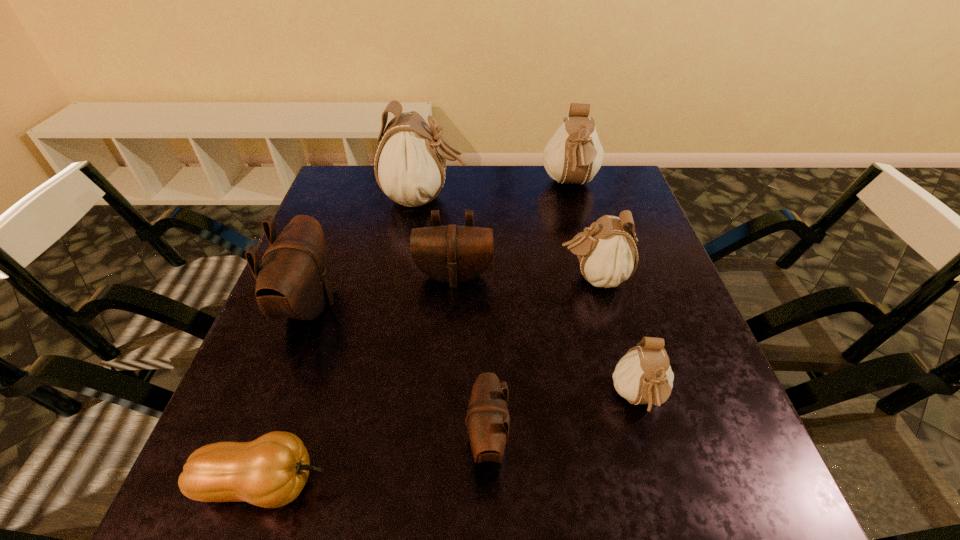
Locate an element on the screen. The width and height of the screenshot is (960, 540). vacant space located on the front-facing side of the biggest white pouch is located at coordinates (565, 199).

Where is `vacant space situated 0.270m on the front-facing side of the third smallest white pouch`? This screenshot has width=960, height=540. vacant space situated 0.270m on the front-facing side of the third smallest white pouch is located at coordinates (593, 271).

This screenshot has height=540, width=960. Find the location of `vacant area situated 0.150m with the flap open on the biggest brown pouch`. vacant area situated 0.150m with the flap open on the biggest brown pouch is located at coordinates (404, 304).

I want to click on free space located on the front-facing side of the third farthest white pouch, so click(408, 278).

Where is `vacant space located on the front-facing side of the third farthest white pouch`? The image size is (960, 540). vacant space located on the front-facing side of the third farthest white pouch is located at coordinates (421, 278).

Locate an element on the screen. free point located 0.170m on the front-facing side of the third farthest white pouch is located at coordinates (486, 278).

Where is `free point located 0.210m with the flap open on the second smallest brown pouch`? free point located 0.210m with the flap open on the second smallest brown pouch is located at coordinates (448, 368).

The height and width of the screenshot is (540, 960). Identify the location of vacant space situated on the front-facing side of the nearest white pouch. (665, 492).

Locate an element on the screen. Image resolution: width=960 pixels, height=540 pixels. vacant space located with the flap open on the nearest brown pouch is located at coordinates (229, 438).

I want to click on vacant region located 0.070m with the flap open on the nearest brown pouch, so [x=424, y=438].